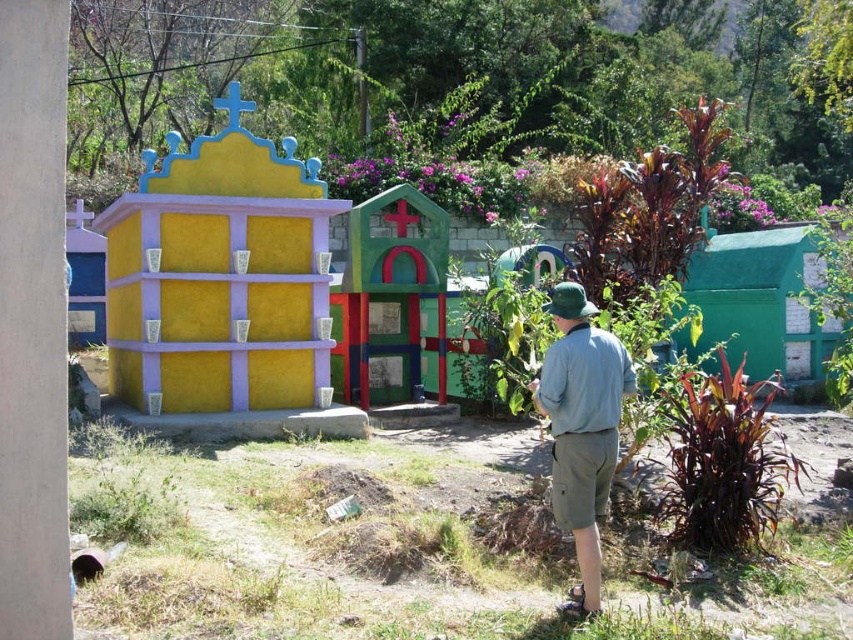
Can you confirm if multicolored painted wooden house at center is thinner than matte yellow wall at left?

In fact, multicolored painted wooden house at center might be wider than matte yellow wall at left.

In the scene shown: Can you confirm if multicolored painted wooden house at center is taller than matte yellow wall at left?

Yes, multicolored painted wooden house at center is taller than matte yellow wall at left.

Does point (347, 317) lie behind point (82, 304)?

That is False.

Image resolution: width=853 pixels, height=640 pixels. Find the location of `multicolored painted wooden house at center`. multicolored painted wooden house at center is located at coordinates (392, 298).

Can you confirm if green matte/tile hut at right is positioned to the left of green cotton shirt at center?

No, green matte/tile hut at right is not to the left of green cotton shirt at center.

Between point (791, 262) and point (605, 337), which one is positioned in front?

Point (605, 337)

You are a GUI agent. You are given a task and a screenshot of the screen. Output one action in this format:
    pyautogui.click(x=<x>, y=<y>)
    Task: Click on the green matte/tile hut at right
    The width and height of the screenshot is (853, 640).
    Given the screenshot: What is the action you would take?
    pyautogui.click(x=762, y=301)

Which is above, yellow matte/beige wall at upper left or green matte/tile hut at right?

Positioned higher is yellow matte/beige wall at upper left.

Between point (120, 230) and point (817, 248), which one is positioned behind?

The point (817, 248) is behind.

Where is `yellow matte/beige wall at upper left`? The width and height of the screenshot is (853, 640). yellow matte/beige wall at upper left is located at coordinates [223, 291].